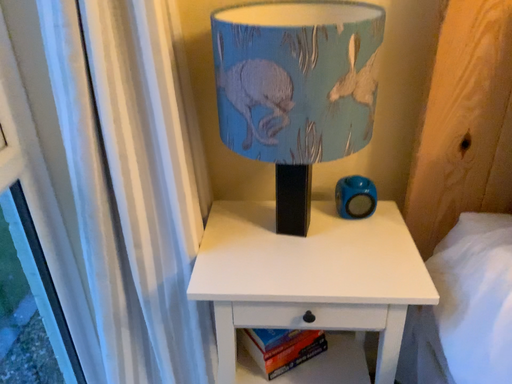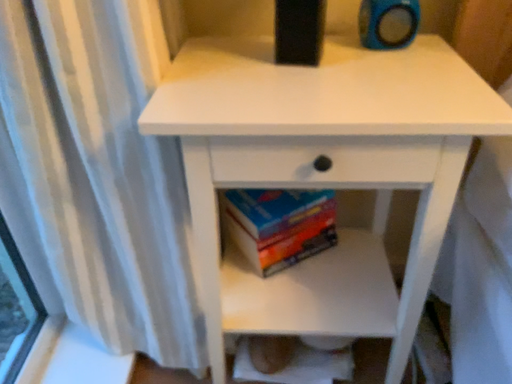
Question: Which way did the camera rotate in the video?

Choices:
 (A) rotated downward
 (B) rotated upward

Answer: (A)